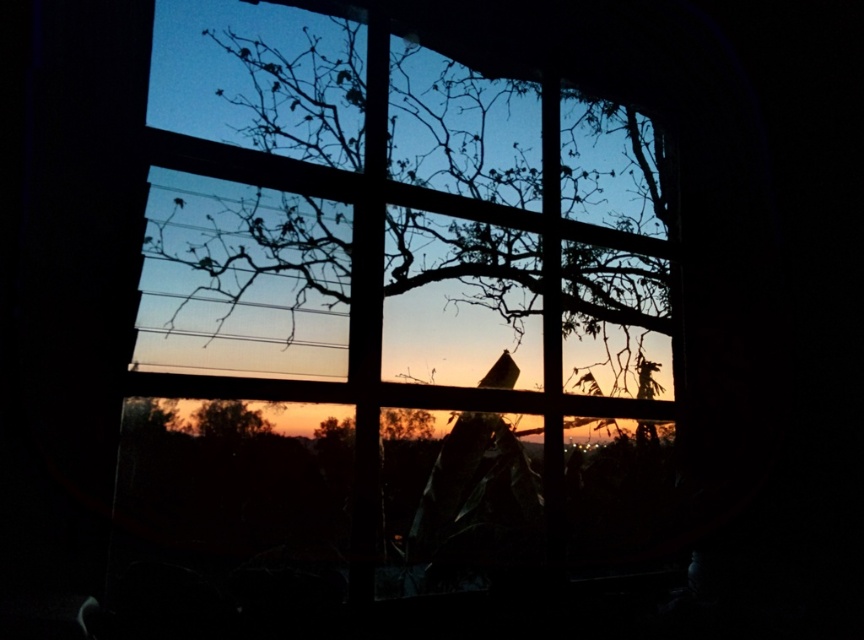
Is silhouette wood tree at center to the right of brown matte tree at lower center from the viewer's perspective?

Indeed, silhouette wood tree at center is positioned on the right side of brown matte tree at lower center.

Is point (638, 134) farther from viewer compared to point (217, 410)?

Yes, point (638, 134) is behind point (217, 410).

This screenshot has height=640, width=864. What are the coordinates of `silhouette wood tree at center` in the screenshot? It's located at (392, 218).